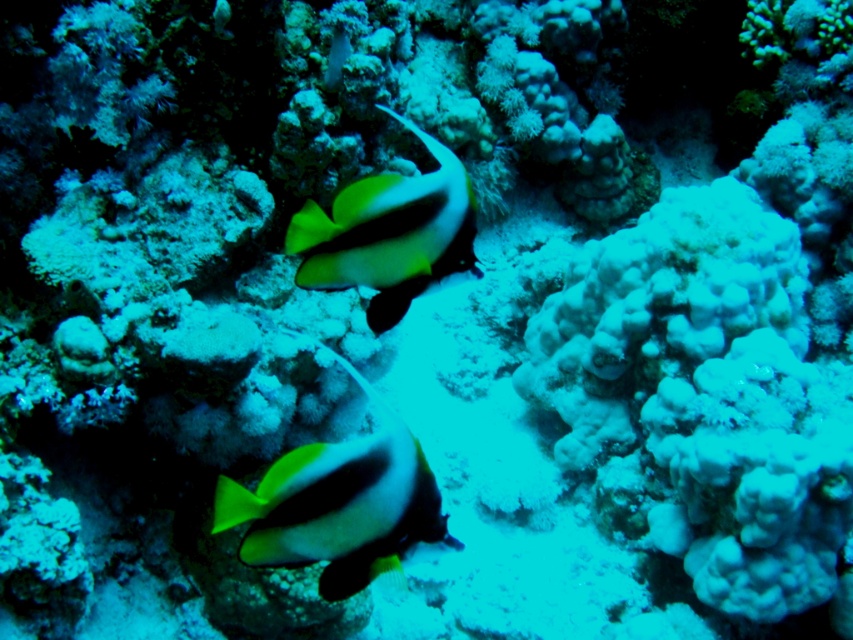
Can you confirm if neon green matte fish at center is positioned below black matte fish at center?

Yes, neon green matte fish at center is below black matte fish at center.

Between neon green matte fish at center and black matte fish at center, which one appears on the right side from the viewer's perspective?

From the viewer's perspective, black matte fish at center appears more on the right side.

Is point (312, 502) less distant than point (439, 260)?

Yes, point (312, 502) is closer to viewer.

Where is `neon green matte fish at center`? This screenshot has height=640, width=853. neon green matte fish at center is located at coordinates (339, 504).